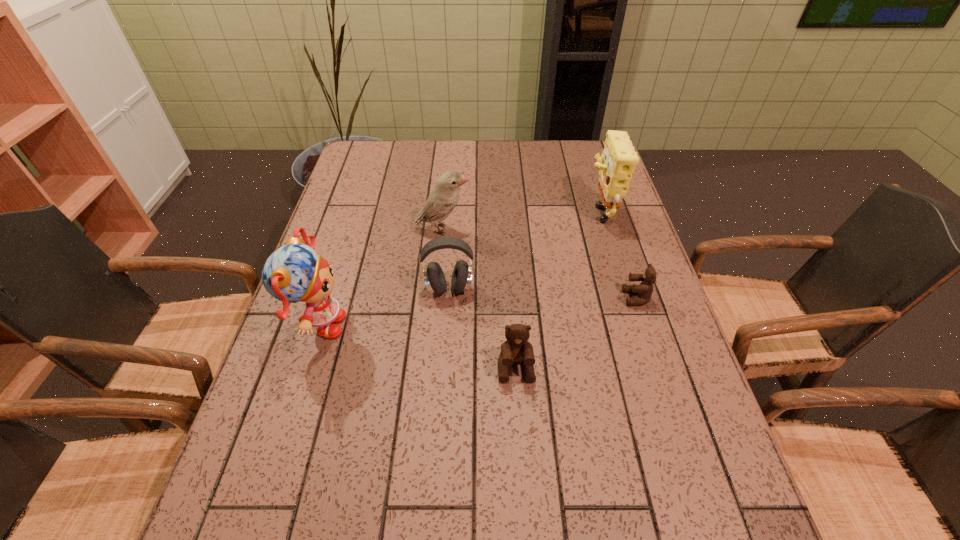
Locate an element on the screen. vacant space that's between the sponge and the third shortest object is located at coordinates (524, 249).

Where is `vacant area that lies between the taller teddy bear and the bird`? vacant area that lies between the taller teddy bear and the bird is located at coordinates (479, 299).

This screenshot has width=960, height=540. Find the location of `free space between the bird and the taller teddy bear`. free space between the bird and the taller teddy bear is located at coordinates (479, 299).

Identify the location of free space between the bird and the right teddy bear. The height and width of the screenshot is (540, 960). (540, 264).

Identify the location of vacant space that's between the headset and the bird. 445,259.

Locate an element on the screen. vacant space in between the leftmost object and the third shortest object is located at coordinates (384, 308).

Locate an element on the screen. The image size is (960, 540). object that is the fifth nearest to the sponge is located at coordinates (293, 273).

Where is `object that ranks as the third closest to the nearer teddy bear`? The height and width of the screenshot is (540, 960). object that ranks as the third closest to the nearer teddy bear is located at coordinates (293, 273).

Find the location of `vacant space that satisfies the following two spatial constraints: 1. on the face of the sponge; 2. on the ear cups of the headset`. vacant space that satisfies the following two spatial constraints: 1. on the face of the sponge; 2. on the ear cups of the headset is located at coordinates (622, 289).

Locate an element on the screen. vacant region that satisfies the following two spatial constraints: 1. on the face of the shortest object; 2. on the face of the nearer teddy bear is located at coordinates (660, 368).